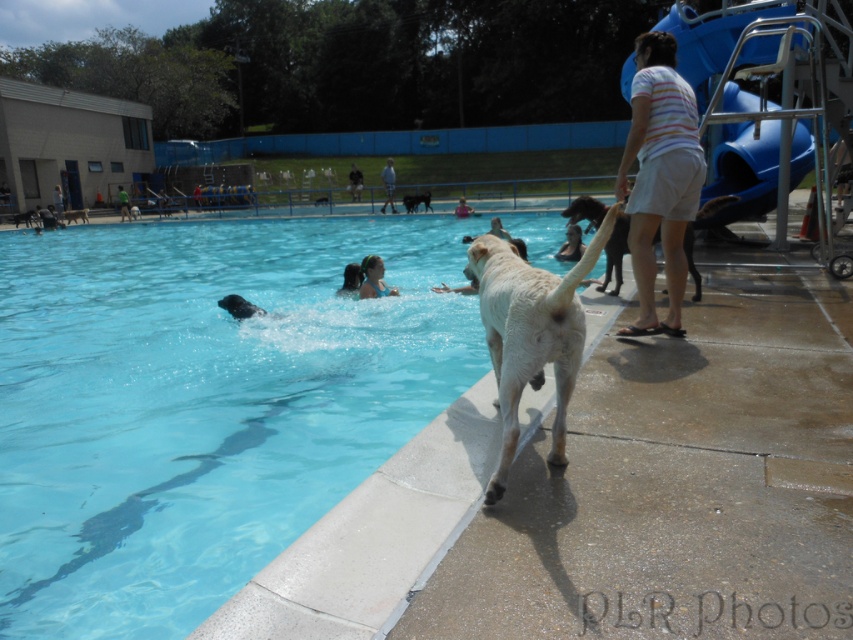
Question: Based on their relative distances, which object is nearer to the dark blue swimsuit at upper left?

Choices:
 (A) white fur dog at upper left
 (B) white fur dog at center
 (C) black fur dog at upper center

Answer: (A)

Question: Can you confirm if white fur dog at lower center is wider than black fur dog at upper center?

Choices:
 (A) yes
 (B) no

Answer: (B)

Question: Which object appears closest to the camera in this image?

Choices:
 (A) light brown hair at upper center
 (B) white fur dog at center
 (C) light blue denim shorts at upper center

Answer: (B)

Question: Can you confirm if dark blue swimsuit at upper left is positioned below light brown hair at upper center?

Choices:
 (A) no
 (B) yes

Answer: (B)

Question: Which is farther from the black shiny dog at upper left?

Choices:
 (A) light brown fur at upper right
 (B) white fur dog at center
 (C) dark blue swimsuit at upper left
 (D) white striped shirt at upper right

Answer: (C)

Question: Is white fur dog at lower center above light brown hair at upper center?

Choices:
 (A) no
 (B) yes

Answer: (A)